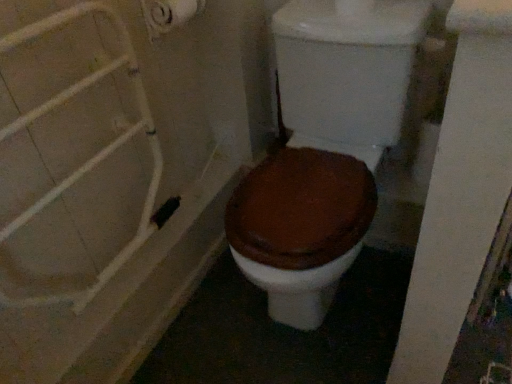
Question: From the image's perspective, is white matte shower door at left beneath white matte toilet paper at upper left?

Choices:
 (A) no
 (B) yes

Answer: (B)

Question: From a real-world perspective, is white matte shower door at left physically below white matte toilet paper at upper left?

Choices:
 (A) yes
 (B) no

Answer: (A)

Question: Can you see white matte shower door at left touching white matte toilet paper at upper left?

Choices:
 (A) yes
 (B) no

Answer: (B)

Question: Is white matte shower door at left smaller than white matte toilet paper at upper left?

Choices:
 (A) yes
 (B) no

Answer: (B)

Question: From a real-world perspective, is white matte shower door at left located higher than white matte toilet paper at upper left?

Choices:
 (A) yes
 (B) no

Answer: (B)

Question: Does white matte shower door at left come behind white matte toilet paper at upper left?

Choices:
 (A) yes
 (B) no

Answer: (B)

Question: Considering the relative sizes of white matte toilet paper at upper left and brown matte toilet at center in the image provided, is white matte toilet paper at upper left smaller than brown matte toilet at center?

Choices:
 (A) yes
 (B) no

Answer: (A)

Question: Is white matte toilet paper at upper left positioned with its back to brown matte toilet at center?

Choices:
 (A) yes
 (B) no

Answer: (B)

Question: Is brown matte toilet at center completely or partially inside white matte toilet paper at upper left?

Choices:
 (A) yes
 (B) no

Answer: (B)

Question: From a real-world perspective, is white matte toilet paper at upper left physically below brown matte toilet at center?

Choices:
 (A) no
 (B) yes

Answer: (A)

Question: Is white matte toilet paper at upper left closer to camera compared to brown matte toilet at center?

Choices:
 (A) yes
 (B) no

Answer: (B)

Question: From a real-world perspective, is white matte toilet paper at upper left on top of brown matte toilet at center?

Choices:
 (A) yes
 (B) no

Answer: (A)

Question: Is brown matte toilet at center bigger than white matte toilet paper at upper left?

Choices:
 (A) yes
 (B) no

Answer: (A)